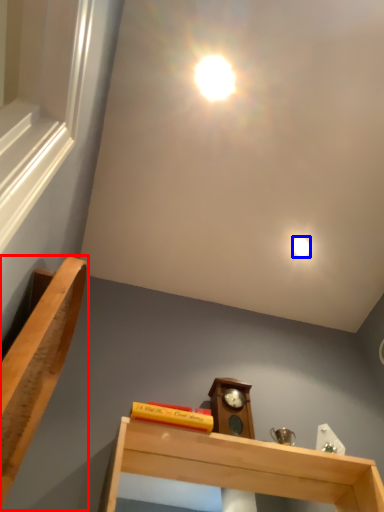
Question: Which object appears closest to the camera in this image, furniture (highlighted by a red box) or droplight (highlighted by a blue box)?

Choices:
 (A) furniture
 (B) droplight

Answer: (A)